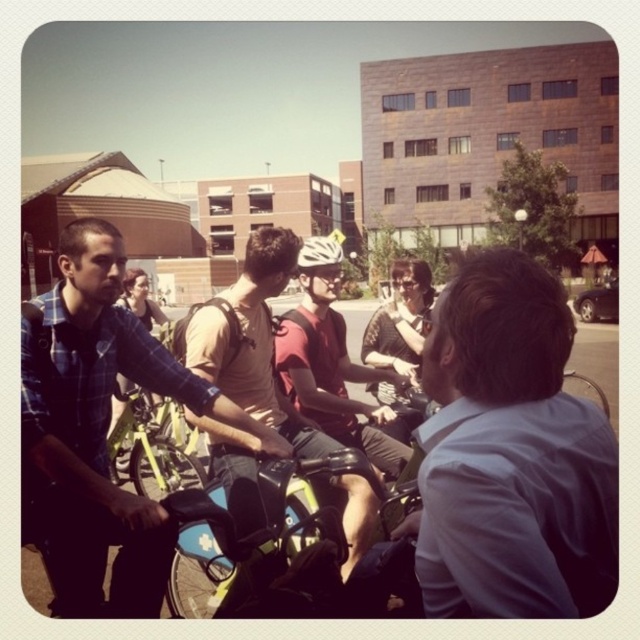
Question: Which point is farther to the camera?

Choices:
 (A) matte beige shirt at center
 (B) matte red helmet at center
 (C) blue matte motorcycle at center
 (D) light blue shirt at center

Answer: (B)

Question: Is plaid shirt at left behind matte red helmet at center?

Choices:
 (A) no
 (B) yes

Answer: (A)

Question: Which of the following is the closest to the observer?

Choices:
 (A) plaid shirt at left
 (B) matte red helmet at center
 (C) light blue shirt at center
 (D) blue matte motorcycle at center

Answer: (C)

Question: Can you confirm if light blue shirt at center is smaller than matte beige shirt at center?

Choices:
 (A) no
 (B) yes

Answer: (A)

Question: Can you confirm if light blue shirt at center is smaller than matte red helmet at center?

Choices:
 (A) yes
 (B) no

Answer: (A)

Question: Which point is farther from the camera taking this photo?

Choices:
 (A) (358, 560)
 (B) (116, 492)
 (C) (403, 384)
 (D) (349, 524)

Answer: (C)